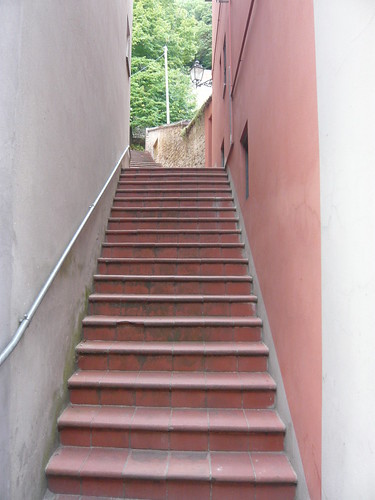
You are a GUI agent. You are given a task and a screenshot of the screen. Output one action in this format:
    pyautogui.click(x=<x>, y=<y>)
    Task: Click on the windows or doors
    The height and width of the screenshot is (500, 375).
    Given the screenshot: What is the action you would take?
    pyautogui.click(x=247, y=179), pyautogui.click(x=223, y=154), pyautogui.click(x=208, y=142), pyautogui.click(x=225, y=72), pyautogui.click(x=127, y=46), pyautogui.click(x=220, y=65)